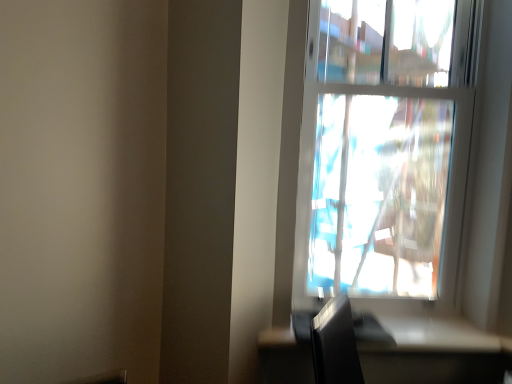
Describe the element at coordinates (385, 149) in the screenshot. This screenshot has height=384, width=512. I see `transparent glass window at upper right` at that location.

In order to click on transparent glass window at upper right in this screenshot , I will do tap(385, 149).

Describe the element at coordinates (430, 352) in the screenshot. Image resolution: width=512 pixels, height=384 pixels. I see `satin black table at lower right` at that location.

The image size is (512, 384). In order to click on satin black table at lower right in this screenshot , I will do `click(430, 352)`.

Locate an element on the screen. transparent glass window at upper right is located at coordinates (385, 149).

Is satin black table at lower right to the left of transparent glass window at upper right from the viewer's perspective?

Yes, satin black table at lower right is to the left of transparent glass window at upper right.

Does satin black table at lower right come in front of transparent glass window at upper right?

Yes, it is in front of transparent glass window at upper right.

Which is behind, point (284, 370) or point (310, 137)?

The point (310, 137) is behind.

Consider the image. From the image's perspective, is satin black table at lower right above or below transparent glass window at upper right?

Based on their image positions, satin black table at lower right is located beneath transparent glass window at upper right.

From a real-world perspective, is satin black table at lower right positioned under transparent glass window at upper right based on gravity?

Yes, from a real-world perspective, satin black table at lower right is below transparent glass window at upper right.

In terms of width, does satin black table at lower right look wider or thinner when compared to transparent glass window at upper right?

satin black table at lower right is wider than transparent glass window at upper right.

Considering the sizes of objects satin black table at lower right and transparent glass window at upper right in the image provided, who is shorter, satin black table at lower right or transparent glass window at upper right?

satin black table at lower right is shorter.

Looking at this image, based on their sizes in the image, would you say satin black table at lower right is bigger or smaller than transparent glass window at upper right?

Clearly, satin black table at lower right is smaller in size than transparent glass window at upper right.

Is transparent glass window at upper right completely or partially inside satin black table at lower right?

No, transparent glass window at upper right is located outside of satin black table at lower right.

Is satin black table at lower right next to transparent glass window at upper right?

No, satin black table at lower right is not with transparent glass window at upper right.

Is satin black table at lower right oriented away from transparent glass window at upper right?

No, transparent glass window at upper right is not at the back of satin black table at lower right.

Can you tell me how much satin black table at lower right and transparent glass window at upper right differ in facing direction?

The facing directions of satin black table at lower right and transparent glass window at upper right are 0.745 degrees apart.

Locate an element on the screen. The image size is (512, 384). table that appears on the left of transparent glass window at upper right is located at coordinates (430, 352).

Between transparent glass window at upper right and satin black table at lower right, which one appears on the left side from the viewer's perspective?

satin black table at lower right.

Considering the positions of objects transparent glass window at upper right and satin black table at lower right in the image provided, who is in front, transparent glass window at upper right or satin black table at lower right?

satin black table at lower right is in front.

Is point (446, 9) farther from camera compared to point (287, 333)?

Yes, it is behind point (287, 333).

From the image's perspective, relative to satin black table at lower right, is transparent glass window at upper right above or below?

From the image's perspective, transparent glass window at upper right appears above satin black table at lower right.

From a real-world perspective, who is located lower, transparent glass window at upper right or satin black table at lower right?

satin black table at lower right.

Can you confirm if transparent glass window at upper right is thinner than satin black table at lower right?

Yes.

Can you confirm if transparent glass window at upper right is taller than satin black table at lower right?

Indeed, transparent glass window at upper right has a greater height compared to satin black table at lower right.

Between transparent glass window at upper right and satin black table at lower right, which one has smaller size?

satin black table at lower right is smaller.

In the scene shown: Is transparent glass window at upper right inside or outside of satin black table at lower right?

The correct answer is: outside.

Would you consider transparent glass window at upper right to be distant from satin black table at lower right?

Indeed, transparent glass window at upper right is not near satin black table at lower right.

Is transparent glass window at upper right looking in the opposite direction of satin black table at lower right?

Result: That's not correct — transparent glass window at upper right is not looking away from satin black table at lower right.

At what (x,y) coordinates should I click in order to perform the action: click on window located behind the satin black table at lower right. Please return your answer as a coordinate pair (x, y). This screenshot has width=512, height=384. Looking at the image, I should click on (385, 149).

In order to click on table beneath the transparent glass window at upper right (from a real-world perspective) in this screenshot , I will do `click(430, 352)`.

Image resolution: width=512 pixels, height=384 pixels. Find the location of `window that is above the satin black table at lower right (from the image's perspective)`. window that is above the satin black table at lower right (from the image's perspective) is located at coordinates (385, 149).